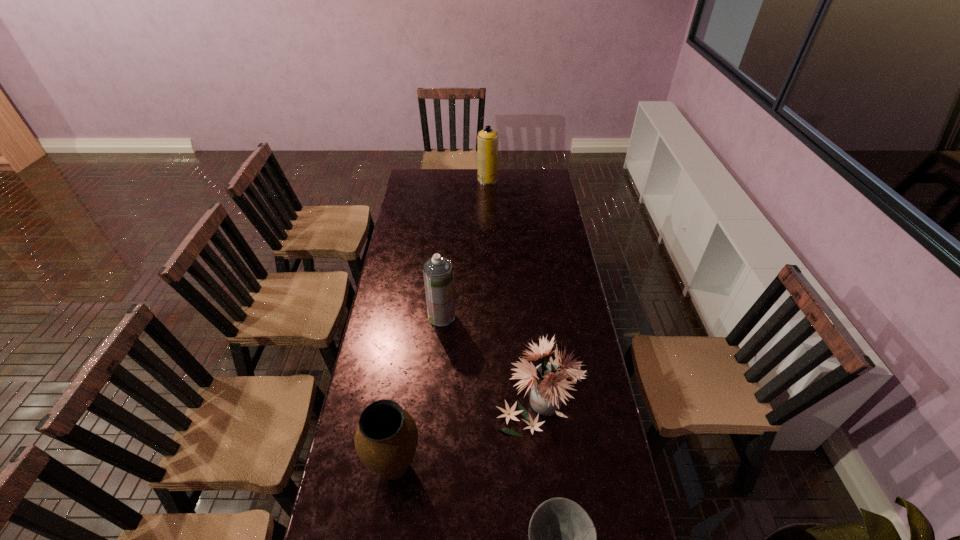
Where is `object present at the far edge`? Image resolution: width=960 pixels, height=540 pixels. object present at the far edge is located at coordinates (487, 140).

You are a GUI agent. You are given a task and a screenshot of the screen. Output one action in this format:
    pyautogui.click(x=<x>, y=<y>)
    Task: Click on the object at the left edge
    This screenshot has height=540, width=960.
    Given the screenshot: What is the action you would take?
    pyautogui.click(x=386, y=437)

Where is `object at the right edge`? The image size is (960, 540). object at the right edge is located at coordinates (549, 380).

This screenshot has height=540, width=960. In order to click on vacant space at the far edge of the desktop in this screenshot , I will do `click(486, 187)`.

The image size is (960, 540). In order to click on vacant space at the left edge in this screenshot , I will do `click(407, 211)`.

Where is `vacant area at the right edge of the desktop`? This screenshot has height=540, width=960. vacant area at the right edge of the desktop is located at coordinates (578, 352).

Where is `free space between the farthest object and the nearer aerosol can`? The image size is (960, 540). free space between the farthest object and the nearer aerosol can is located at coordinates (465, 248).

Identify the location of vacant space in between the second nearest object and the fourth nearest object. (419, 392).

Find the location of a particular element. This screenshot has height=540, width=960. empty location between the urn and the nearer aerosol can is located at coordinates (419, 392).

Find the location of `vacant region between the second nearest object and the fourth nearest object`. vacant region between the second nearest object and the fourth nearest object is located at coordinates (419, 392).